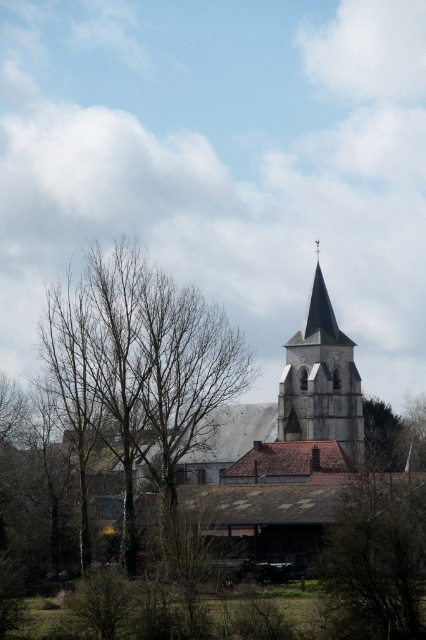
Question: Which of these objects is positioned farthest from the brown wood tree at center?

Choices:
 (A) bare wood tree at center
 (B) smooth gray steeple at center

Answer: (A)

Question: Which of the following is the farthest from the observer?

Choices:
 (A) (344, 416)
 (B) (163, 454)

Answer: (A)

Question: Can you confirm if bare wood tree at center is thinner than smooth gray steeple at center?

Choices:
 (A) yes
 (B) no

Answer: (B)

Question: Does brown wood tree at center have a lesser width compared to smooth gray steeple at center?

Choices:
 (A) yes
 (B) no

Answer: (B)

Question: Can you confirm if bare wood tree at center is positioned to the left of brown wood tree at center?

Choices:
 (A) yes
 (B) no

Answer: (A)

Question: Which point is closer to the camera?

Choices:
 (A) smooth gray steeple at center
 (B) brown wood tree at center

Answer: (B)